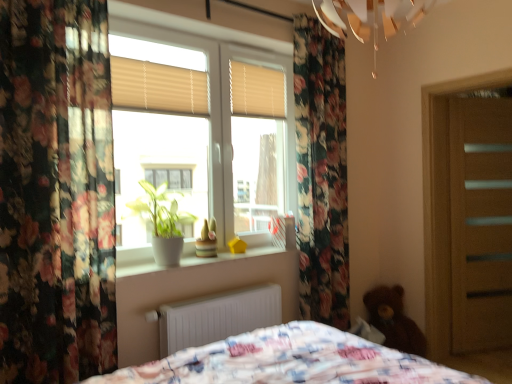
Question: Can you confirm if white matte radiator at lower center is taller than white plastic window at center?

Choices:
 (A) yes
 (B) no

Answer: (B)

Question: Is white matte radiator at lower center shorter than white plastic window at center?

Choices:
 (A) no
 (B) yes

Answer: (B)

Question: Is white matte radiator at lower center placed right next to white plastic window at center?

Choices:
 (A) no
 (B) yes

Answer: (A)

Question: Are white matte radiator at lower center and white plastic window at center located far from each other?

Choices:
 (A) no
 (B) yes

Answer: (A)

Question: Does white matte radiator at lower center have a greater width compared to white plastic window at center?

Choices:
 (A) yes
 (B) no

Answer: (A)

Question: Is white matte radiator at lower center positioned with its back to white plastic window at center?

Choices:
 (A) no
 (B) yes

Answer: (A)

Question: Does floral fabric curtain at left lie in front of brown plush teddy bear at lower right?

Choices:
 (A) no
 (B) yes

Answer: (B)

Question: Considering the relative sizes of floral fabric curtain at left and brown plush teddy bear at lower right in the image provided, is floral fabric curtain at left smaller than brown plush teddy bear at lower right?

Choices:
 (A) yes
 (B) no

Answer: (B)

Question: Is floral fabric curtain at left at the left side of brown plush teddy bear at lower right?

Choices:
 (A) yes
 (B) no

Answer: (A)

Question: From a real-world perspective, is floral fabric curtain at left under brown plush teddy bear at lower right?

Choices:
 (A) no
 (B) yes

Answer: (A)

Question: Is floral fabric curtain at left completely or partially outside of brown plush teddy bear at lower right?

Choices:
 (A) no
 (B) yes

Answer: (B)

Question: Does floral fabric curtain at left have a greater height compared to brown plush teddy bear at lower right?

Choices:
 (A) no
 (B) yes

Answer: (B)

Question: Can you confirm if brown plush teddy bear at lower right is thinner than beige/wooden blinds at upper center, arranged as the second shutter when viewed from the front?

Choices:
 (A) no
 (B) yes

Answer: (A)